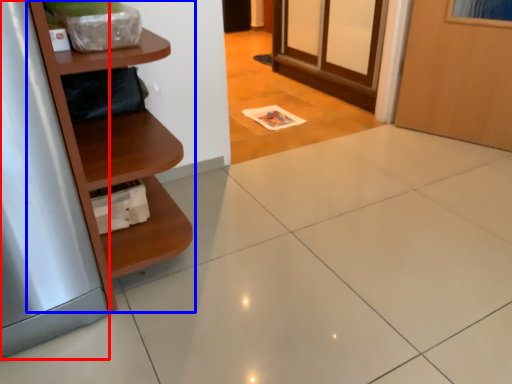
Question: Which of the following is the closest to the observer, silver (highlighted by a red box) or shelf (highlighted by a blue box)?

Choices:
 (A) silver
 (B) shelf

Answer: (A)